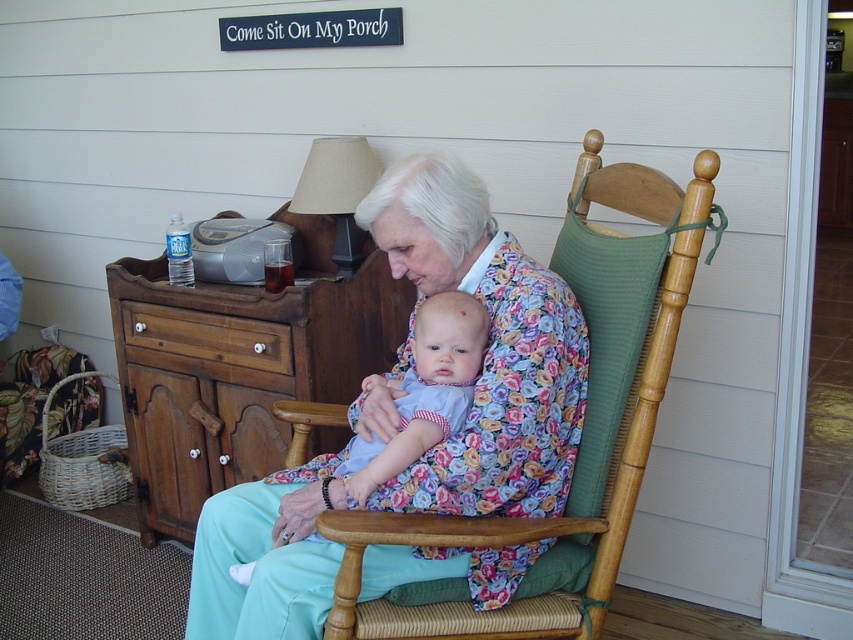
Question: Which point is closer to the camera taking this photo?

Choices:
 (A) (492, 440)
 (B) (653, 400)
 (C) (476, 364)

Answer: (A)

Question: Can you confirm if light blue fabric baby at center is thinner than brown wood drawer at left?

Choices:
 (A) no
 (B) yes

Answer: (B)

Question: Observing the image, what is the correct spatial positioning of floral fabric dress at center in reference to light blue fabric dress at center?

Choices:
 (A) above
 (B) below

Answer: (A)

Question: Is woven wood armchair at center below light blue fabric dress at center?

Choices:
 (A) no
 (B) yes

Answer: (A)

Question: Which object is farther from the camera taking this photo?

Choices:
 (A) woven wood armchair at center
 (B) light blue fabric baby at center
 (C) brown wood dresser at left

Answer: (C)

Question: Among these points, which one is nearest to the camera?

Choices:
 (A) (403, 419)
 (B) (451, 388)
 (C) (178, 432)

Answer: (B)